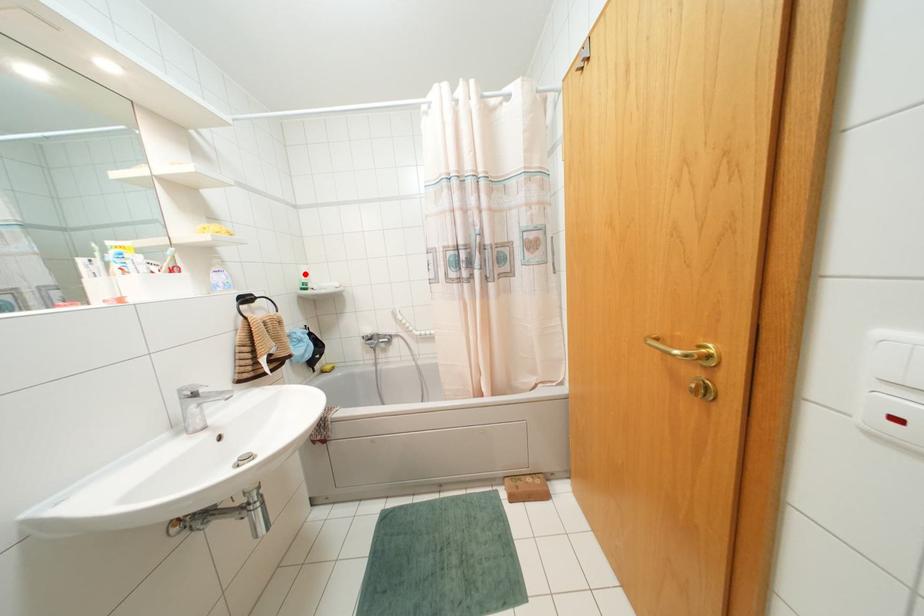
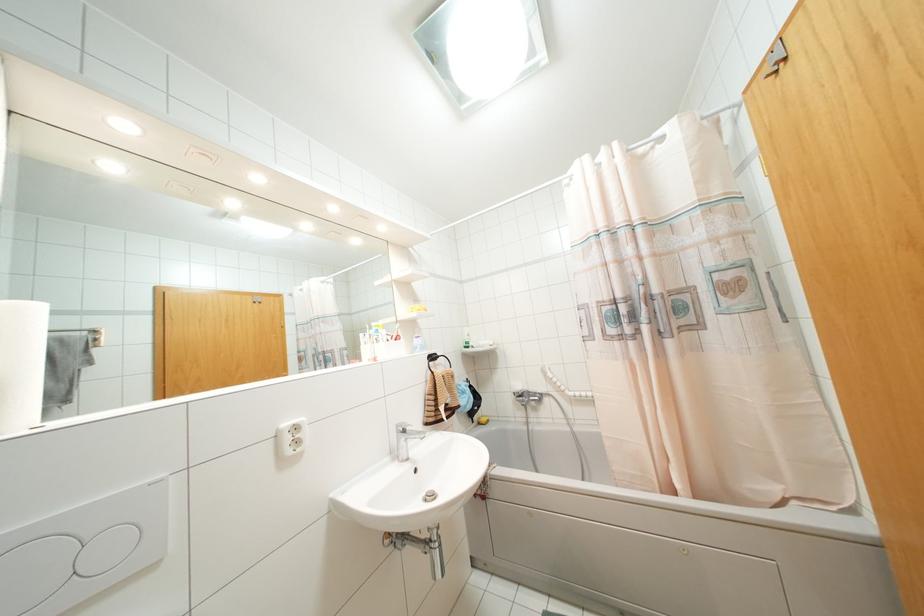
Question: I am providing you with two images of the same scene from different viewpoints. A red point is marked on the first image. At the location where the point appears in image 1, is it still visible in image 2?

Choices:
 (A) Yes
 (B) No

Answer: (A)